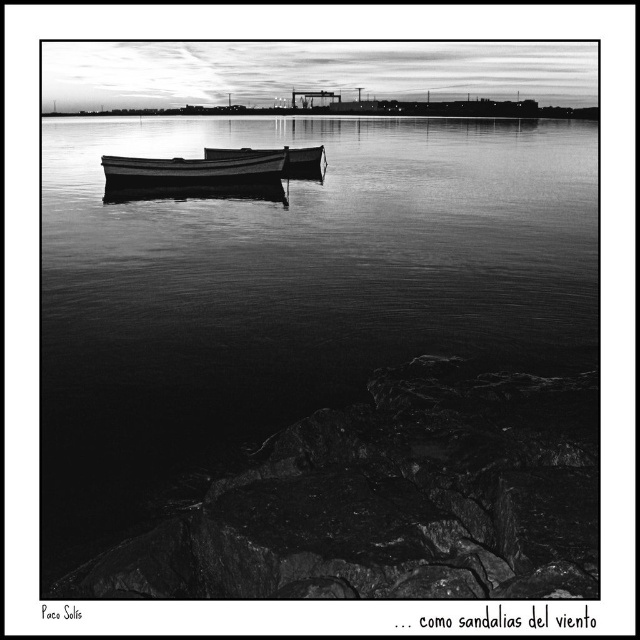
Which is in front, point (160, 166) or point (237, 156)?

Point (160, 166) is in front.

Is smooth wood canoe at center thinner than wooden canoe at center?

Yes.

Does point (202, 176) come closer to viewer compared to point (244, 150)?

Yes, it is in front of point (244, 150).

Image resolution: width=640 pixels, height=640 pixels. Find the location of `smooth wood canoe at center`. smooth wood canoe at center is located at coordinates (192, 172).

Who is more distant from viewer, (99,429) or (275,176)?

The point (275,176) is behind.

Measure the distance between point (252, 211) and camera.

22.96 meters

Find the location of `smooth water at center`. smooth water at center is located at coordinates (289, 284).

Between point (584, 321) and point (284, 172), which one is positioned in front?

Point (584, 321)

Is smooth water at center shorter than wooden canoe at center?

No.

Is point (381, 144) closer to viewer compared to point (243, 148)?

No, (381, 144) is behind (243, 148).

Where is `smooth water at center`? The width and height of the screenshot is (640, 640). smooth water at center is located at coordinates (289, 284).